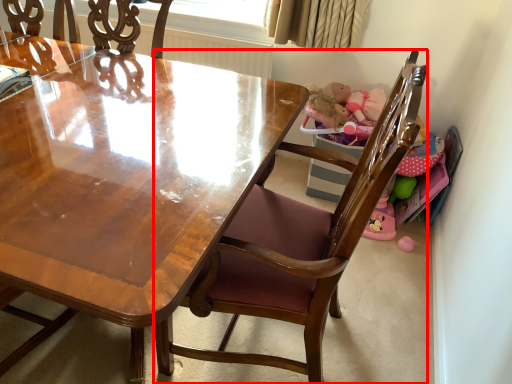
Question: Where is chair (annotated by the red box) located in relation to window screen in the image?

Choices:
 (A) left
 (B) right

Answer: (B)